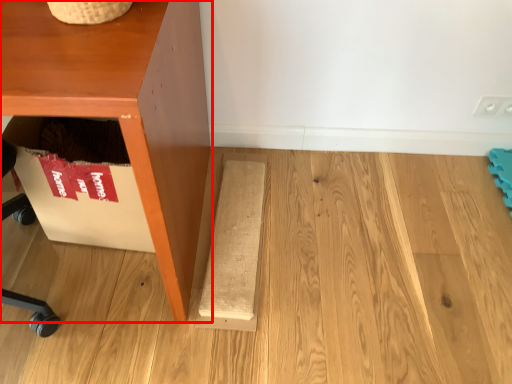
Question: From the image's perspective, considering the relative positions of furniture (annotated by the red box) and plank in the image provided, where is furniture (annotated by the red box) located with respect to the staircase?

Choices:
 (A) below
 (B) above

Answer: (B)